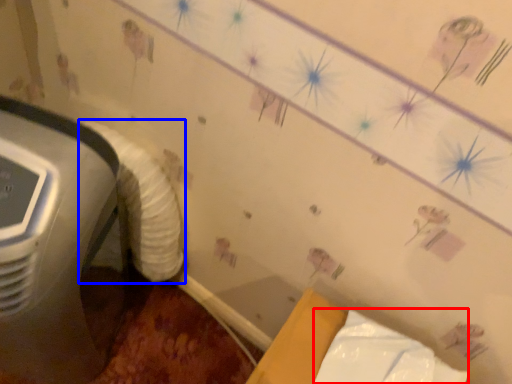
Question: Which object appears farthest to the camera in this image, wrapping paper (highlighted by a red box) or sheet (highlighted by a blue box)?

Choices:
 (A) wrapping paper
 (B) sheet

Answer: (B)